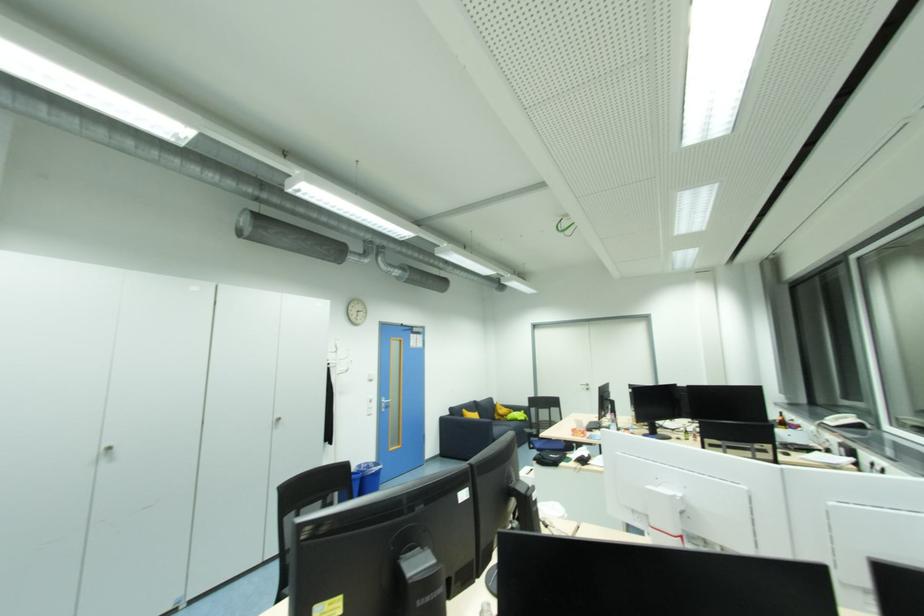
Identify the location of silver door handle. (383, 403).